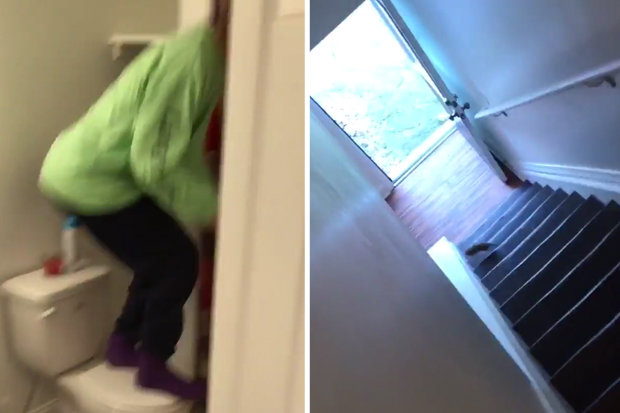
In order to click on glare on wall in this screenshot , I will do `click(355, 208)`.